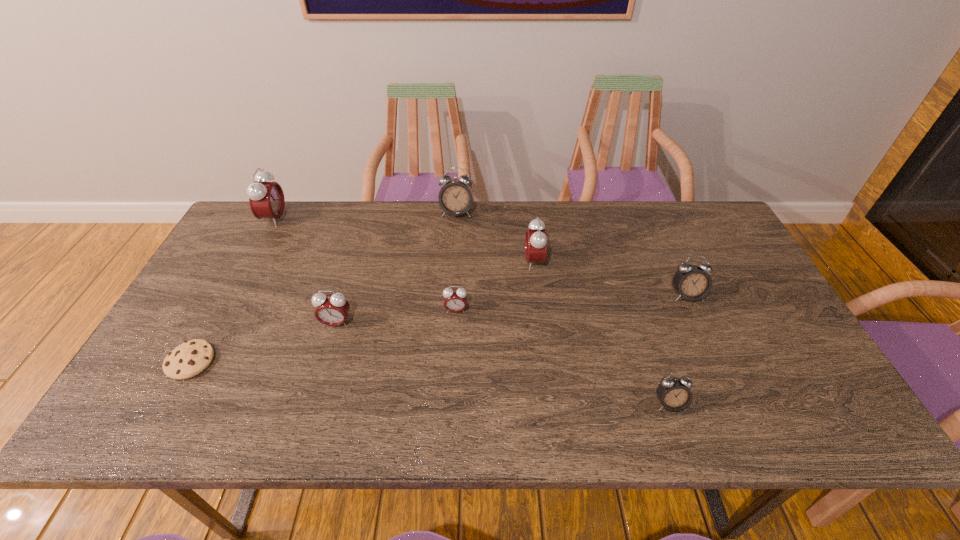
Locate an element on the screen. This screenshot has width=960, height=540. the biggest pink alarm clock is located at coordinates (266, 199).

You are a GUI agent. You are given a task and a screenshot of the screen. Output one action in this format:
    pyautogui.click(x=<x>, y=<y>)
    Task: Click on the tallest object
    Image resolution: width=960 pixels, height=540 pixels.
    Given the screenshot: What is the action you would take?
    pyautogui.click(x=266, y=199)

Where is `the farthest white alarm clock`? the farthest white alarm clock is located at coordinates click(455, 198).

Find the location of `the biggest white alarm clock`. the biggest white alarm clock is located at coordinates (455, 198).

At what (x,y) coordinates should I click in order to perform the action: click on the third farthest alarm clock. Please return your answer as a coordinate pair (x, y). Looking at the image, I should click on (536, 240).

Locate an element on the screen. Image resolution: width=960 pixels, height=540 pixels. the second farthest pink alarm clock is located at coordinates pyautogui.click(x=536, y=240).

The width and height of the screenshot is (960, 540). I want to click on the sixth object from right to left, so click(x=332, y=309).

The width and height of the screenshot is (960, 540). Find the location of `the second pink alarm clock from left to right`. the second pink alarm clock from left to right is located at coordinates pyautogui.click(x=332, y=309).

Locate an element on the screen. This screenshot has height=540, width=960. the second smallest white alarm clock is located at coordinates 692,283.

The height and width of the screenshot is (540, 960). What are the coordinates of `the rightmost object` in the screenshot? It's located at (692, 283).